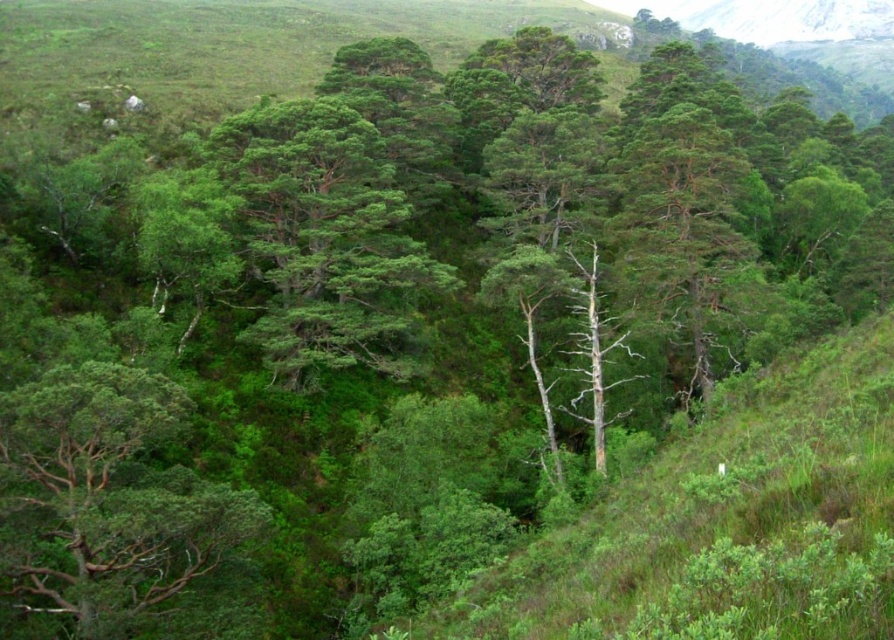
You are standing at the center of the forest and want to locate the brown rough bark tree at lower left. According to the coordinates provided, in which direction should you move to find it?

The brown rough bark tree at lower left is located at point (105, 497), which is in the lower left direction from your current position at the center of the forest.